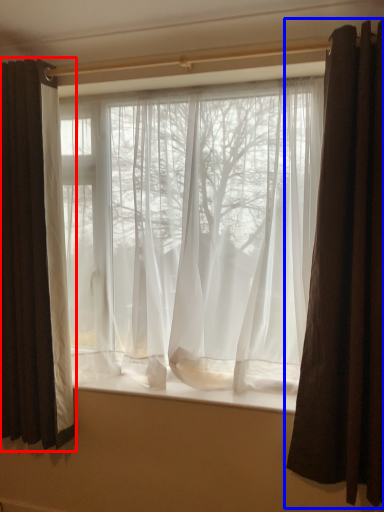
Question: Which object appears farthest to the camera in this image, curtain (highlighted by a red box) or curtain (highlighted by a blue box)?

Choices:
 (A) curtain
 (B) curtain

Answer: (A)